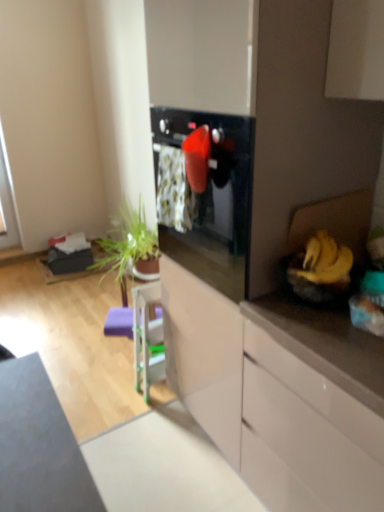
This screenshot has height=512, width=384. I want to click on vacant region to the left of white glossy dresser at center, so (x=137, y=435).